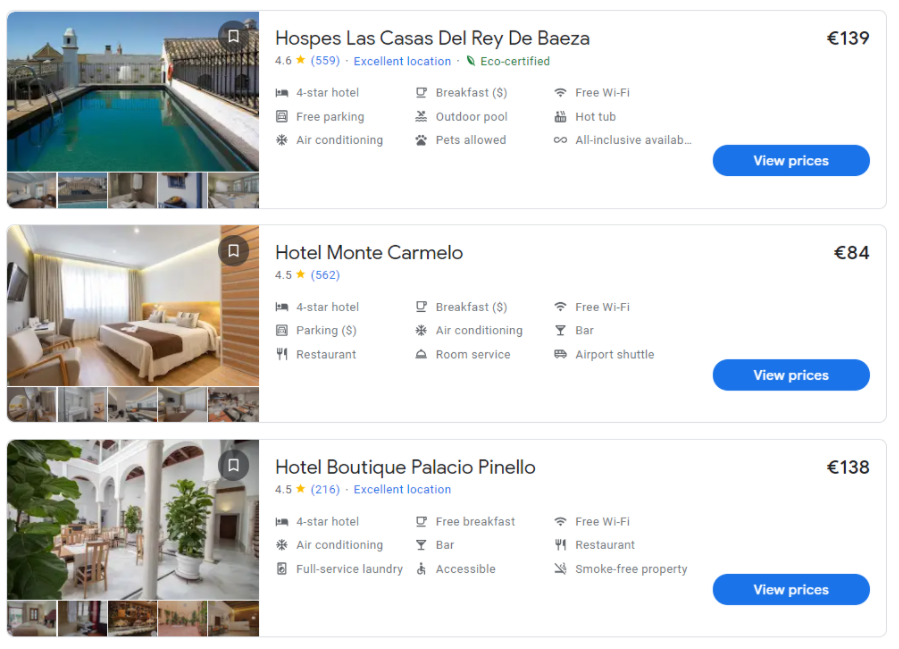
Image resolution: width=899 pixels, height=649 pixels. In order to click on tv in this screenshot , I will do `click(20, 295)`.